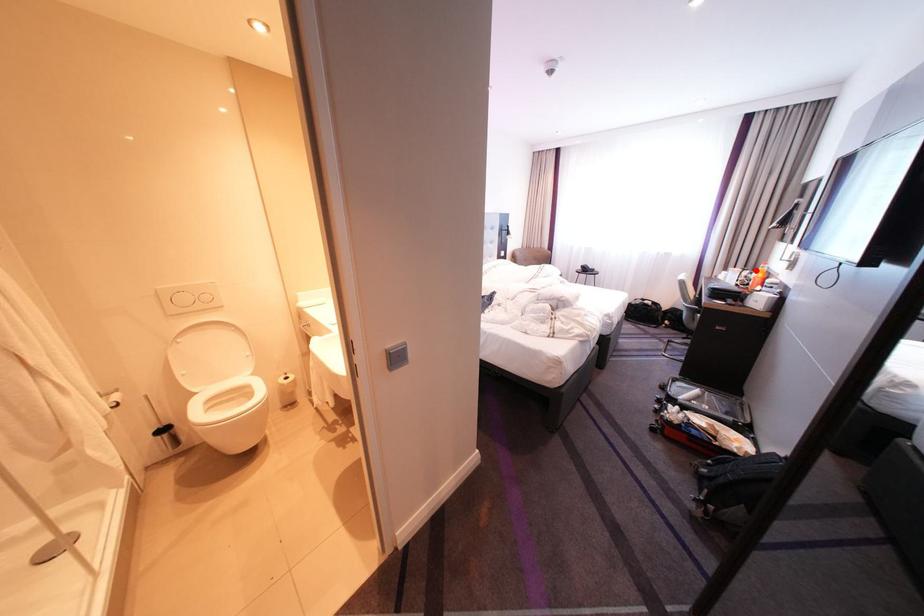
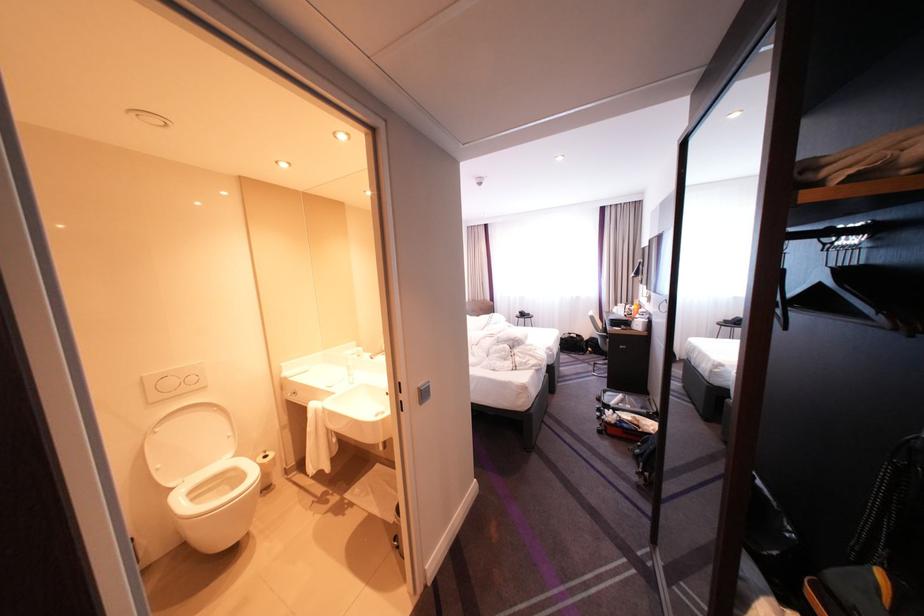
Question: I am providing you with two images of the same scene from different viewpoints. In image1, a red point is highlighted. Considering the same 3D point in image2, which of the following is correct?

Choices:
 (A) It is closer
 (B) It is farther

Answer: (A)